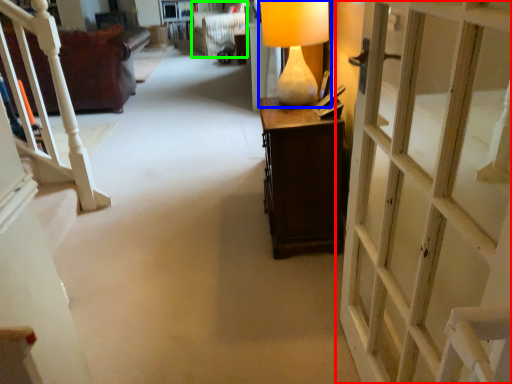
Question: Estimate the real-world distances between objects in this image. Which object is farther from door (highlighted by a red box), table lamp (highlighted by a blue box) or armchair (highlighted by a green box)?

Choices:
 (A) table lamp
 (B) armchair

Answer: (B)